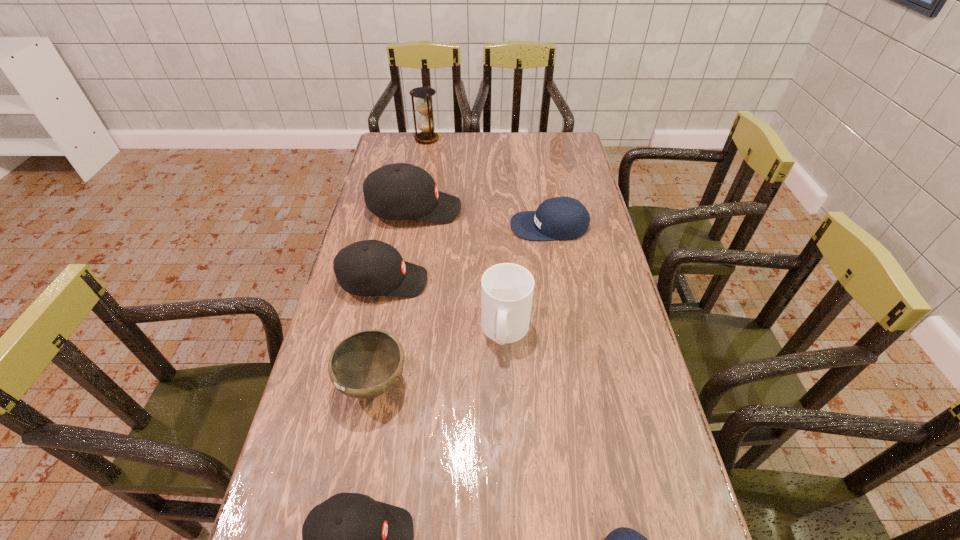
Select which baseball cap appears as the second closest to the farther blue baseball cap. Please provide its 2D coordinates. Your answer should be formatted as a tuple, i.e. [(x, y)], where the tuple contains the x and y coordinates of a point satisfying the conditions above.

[(371, 267)]

Choose which gray baseball cap is the nearest neighbor to the tallest baseball cap. Please provide its 2D coordinates. Your answer should be formatted as a tuple, i.e. [(x, y)], where the tuple contains the x and y coordinates of a point satisfying the conditions above.

[(371, 267)]

Identify the location of gray baseball cap identified as the second closest to the brown hourglass. (371, 267).

I want to click on vacant point that satisfies the following two spatial constraints: 1. on the front-facing side of the bigger blue baseball cap; 2. on the handle side of the white mug, so click(x=567, y=330).